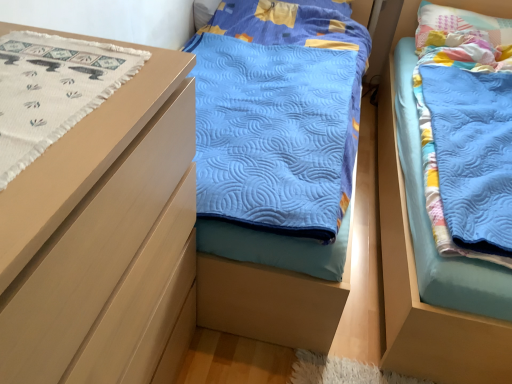
Question: Is point (186, 94) closer or farther from the camera than point (413, 327)?

Choices:
 (A) closer
 (B) farther

Answer: (A)

Question: From the image's perspective, is matte wood chest of drawers at left above or below blue quilted blanket at right?

Choices:
 (A) above
 (B) below

Answer: (B)

Question: Which is farther from the white woven fabric at left?

Choices:
 (A) matte wood chest of drawers at left
 (B) pastel patchwork pillow at upper right
 (C) blue quilted blanket at right

Answer: (B)

Question: Which is farther from the white woven fabric at left?

Choices:
 (A) matte wood chest of drawers at left
 (B) blue quilted blanket at right
 (C) pastel patchwork pillow at upper right

Answer: (C)